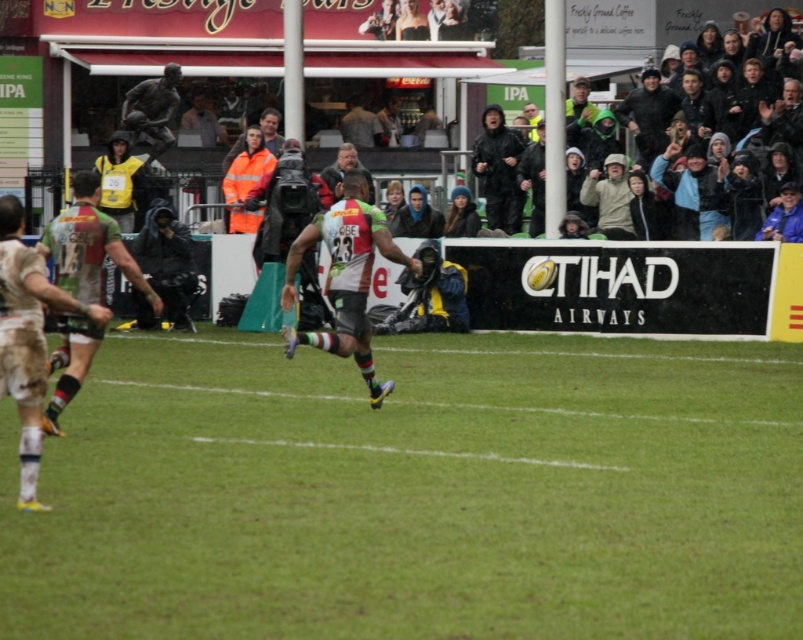
Question: Which object is the farthest from the green grass at center?

Choices:
 (A) camouflage-patterned shorts at center
 (B) dark brown leather jacket at center
 (C) camouflage-patterned shorts at left
 (D) orange reflective jacket at upper center

Answer: (D)

Question: Which point is farther to the camera?

Choices:
 (A) orange reflective jacket at upper center
 (B) camouflage-patterned shorts at left
 (C) dark brown leather jacket at center

Answer: (A)

Question: In this image, where is green grass at center located relative to camouflage-patterned shorts at center?

Choices:
 (A) left
 (B) right

Answer: (B)

Question: Where is green grass at center located in relation to dark brown leather jacket at center in the image?

Choices:
 (A) left
 (B) right

Answer: (B)

Question: Does camouflage-patterned jersey at left have a smaller size compared to dark brown leather jacket at center?

Choices:
 (A) yes
 (B) no

Answer: (B)

Question: Which object appears closest to the camera in this image?

Choices:
 (A) green grass at center
 (B) camouflage-patterned jersey at left
 (C) orange reflective jacket at upper center
 (D) camouflage-patterned shorts at left

Answer: (A)